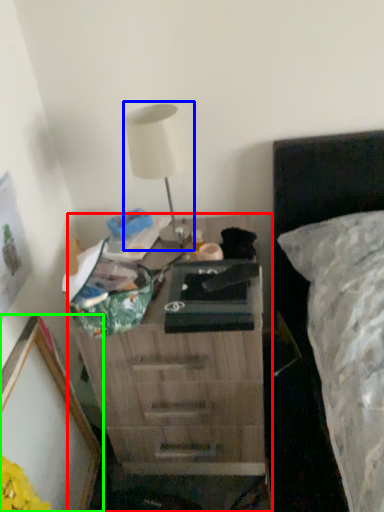
Question: Estimate the real-world distances between objects in this image. Which object is closer to nightstand (highlighted by a red box), table lamp (highlighted by a blue box) or picture frame (highlighted by a green box)?

Choices:
 (A) table lamp
 (B) picture frame

Answer: (B)